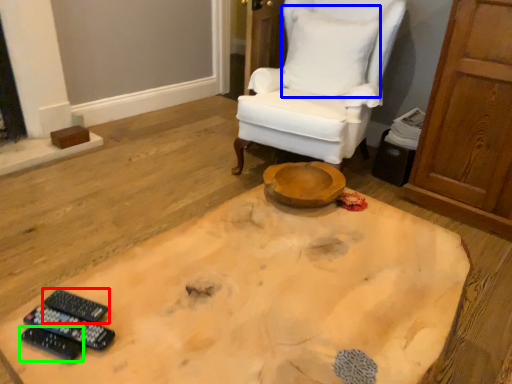
Question: Which object is positioned farthest from remote control (highlighted by a red box)? Select from pillow (highlighted by a blue box) and remote control (highlighted by a green box).

Choices:
 (A) pillow
 (B) remote control

Answer: (A)